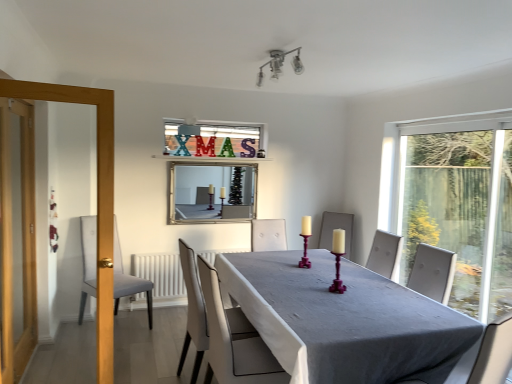
Question: Is wooden screen door at left wider than purple wood candle holder at center, positioned as the 1th candle holder in back-to-front order?

Choices:
 (A) yes
 (B) no

Answer: (A)

Question: Is wooden screen door at left taller than purple wood candle holder at center, placed as the 2th candle holder when sorted from right to left?

Choices:
 (A) yes
 (B) no

Answer: (A)

Question: From a real-world perspective, is wooden screen door at left located beneath purple wood candle holder at center, positioned as the 1th candle holder in back-to-front order?

Choices:
 (A) yes
 (B) no

Answer: (B)

Question: Could purple wood candle holder at center, the first candle holder from the left, be considered to be inside wooden screen door at left?

Choices:
 (A) yes
 (B) no

Answer: (B)

Question: From a real-world perspective, is wooden screen door at left on purple wood candle holder at center, the second candle holder in the front-to-back sequence?

Choices:
 (A) no
 (B) yes

Answer: (B)

Question: In terms of size, does matte purple candlestick at center, acting as the 1th candle holder starting from the right, appear bigger or smaller than purple wood candle holder at center, the second candle holder in the front-to-back sequence?

Choices:
 (A) big
 (B) small

Answer: (A)

Question: Is matte purple candlestick at center, placed as the first candle holder when sorted from front to back, to the left or to the right of purple wood candle holder at center, placed as the 2th candle holder when sorted from right to left, in the image?

Choices:
 (A) right
 (B) left

Answer: (A)

Question: Is matte purple candlestick at center, the 2th candle holder viewed from the back, inside or outside of purple wood candle holder at center, the second candle holder in the front-to-back sequence?

Choices:
 (A) inside
 (B) outside

Answer: (B)

Question: Considering their positions, is matte purple candlestick at center, the 2th candle holder viewed from the back, located in front of or behind purple wood candle holder at center, placed as the 2th candle holder when sorted from right to left?

Choices:
 (A) behind
 (B) front

Answer: (B)

Question: Is silver/glass mirror at upper center to the left or to the right of white leather chair at center, acting as the 1th chair starting from the front, in the image?

Choices:
 (A) left
 (B) right

Answer: (A)

Question: In terms of size, does silver/glass mirror at upper center appear bigger or smaller than white leather chair at center, acting as the 1th chair starting from the front?

Choices:
 (A) big
 (B) small

Answer: (B)

Question: Is point (207, 183) positioned closer to the camera than point (179, 251)?

Choices:
 (A) farther
 (B) closer

Answer: (A)

Question: Is silver/glass mirror at upper center spatially inside white leather chair at center, acting as the 2th chair starting from the left, or outside of it?

Choices:
 (A) inside
 (B) outside

Answer: (B)

Question: Is smooth gray table at center situated inside metallic glass light fixture at upper center or outside?

Choices:
 (A) outside
 (B) inside

Answer: (A)

Question: Relative to metallic glass light fixture at upper center, is smooth gray table at center in front or behind?

Choices:
 (A) behind
 (B) front

Answer: (B)